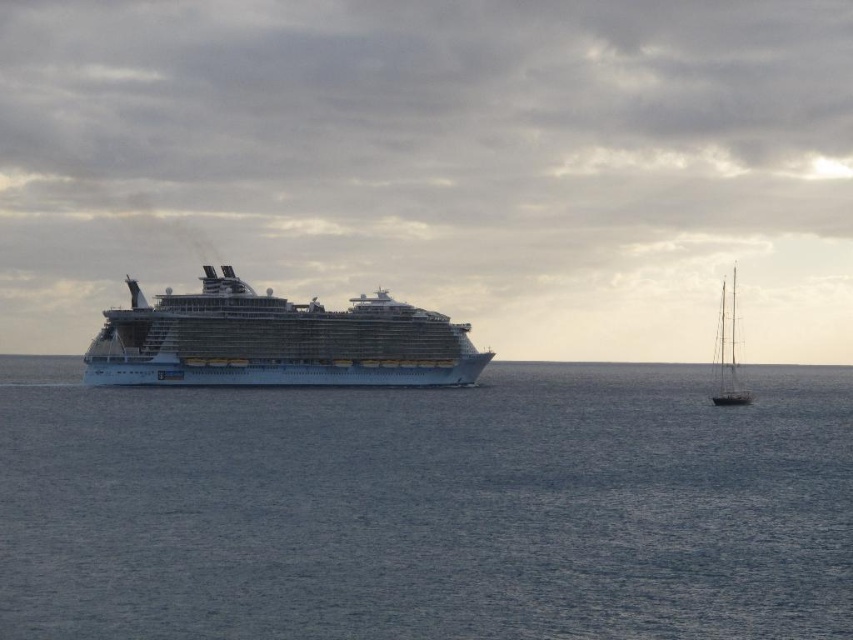
Which is in front, point (105, 324) or point (722, 300)?

Positioned in front is point (105, 324).

Between white glossy cruise ship at center and wooden sailboat at right, which one is positioned higher?

white glossy cruise ship at center is above.

At what (x,y) coordinates should I click in order to perform the action: click on white glossy cruise ship at center. Please return your answer as a coordinate pair (x, y). The image size is (853, 640). Looking at the image, I should click on (276, 340).

Between blue water at center and white glossy cruise ship at center, which one appears on the right side from the viewer's perspective?

blue water at center is more to the right.

Can you confirm if blue water at center is positioned to the right of white glossy cruise ship at center?

Correct, you'll find blue water at center to the right of white glossy cruise ship at center.

Between point (511, 394) and point (306, 317), which one is positioned in front?

Point (306, 317) is in front.

Identify the location of blue water at center. (427, 508).

Can you confirm if blue water at center is positioned to the left of wooden sailboat at right?

Correct, you'll find blue water at center to the left of wooden sailboat at right.

Is blue water at center thinner than wooden sailboat at right?

No.

Identify the location of blue water at center. The height and width of the screenshot is (640, 853). point(427,508).